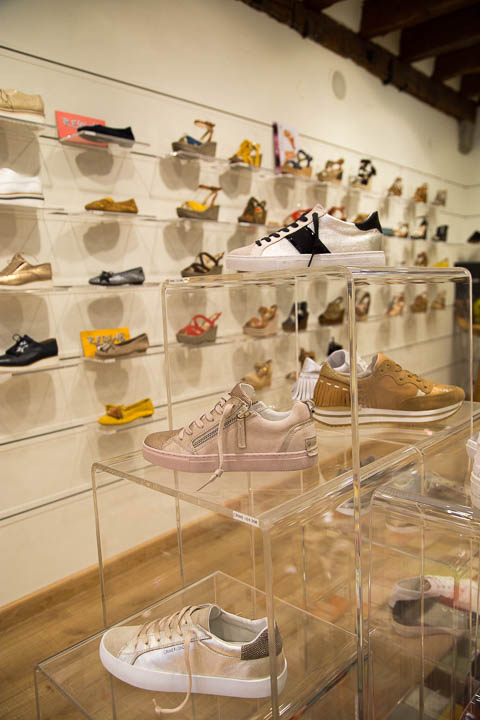
Image resolution: width=480 pixels, height=720 pixels. Find the location of `lace`. lace is located at coordinates (227, 445), (186, 667), (315, 228), (22, 340), (16, 258), (7, 96).